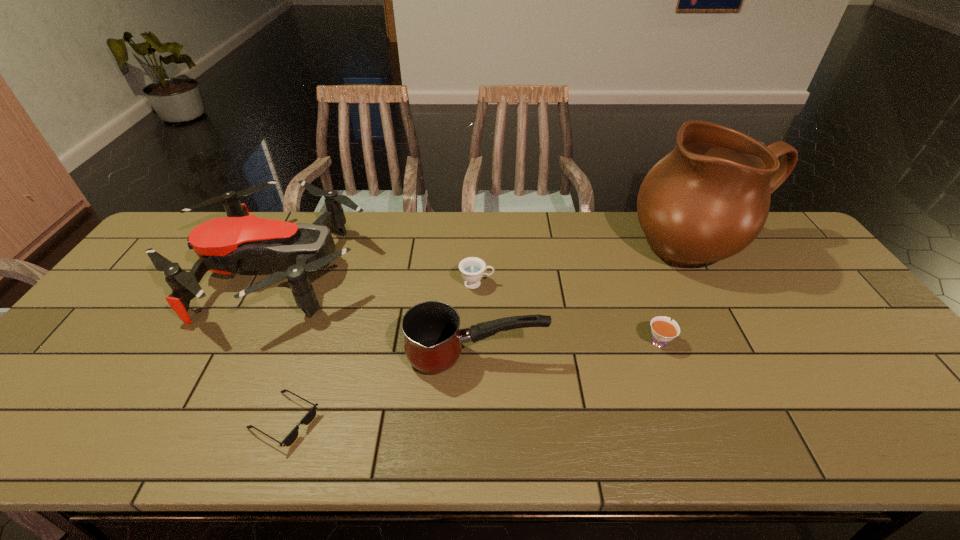
Identify the location of cream pitcher. (708, 199).

Identify the location of drone. The image size is (960, 540). (223, 245).

The width and height of the screenshot is (960, 540). Find the location of `saucepan`. saucepan is located at coordinates (433, 341).

Identify the location of the farther teacup. The image size is (960, 540). (472, 269).

The image size is (960, 540). Identify the location of the second shortest object. (663, 330).

You are a GUI agent. You are given a task and a screenshot of the screen. Output one action in this format:
    pyautogui.click(x=<x>, y=<y>)
    Task: Click on the right teacup
    Image resolution: width=960 pixels, height=540 pixels.
    Given the screenshot: What is the action you would take?
    pyautogui.click(x=663, y=330)

Locate an element on the screen. This screenshot has height=540, width=960. the nearest object is located at coordinates (310, 416).

Where is `sunglasses`? This screenshot has height=540, width=960. sunglasses is located at coordinates (310, 416).

Image resolution: width=960 pixels, height=540 pixels. Find the location of `vacant area located 0.050m at the spout of the cream pitcher`. vacant area located 0.050m at the spout of the cream pitcher is located at coordinates (728, 299).

Image resolution: width=960 pixels, height=540 pixels. Identify the location of free space located 0.310m on the camera side of the drone. (470, 270).